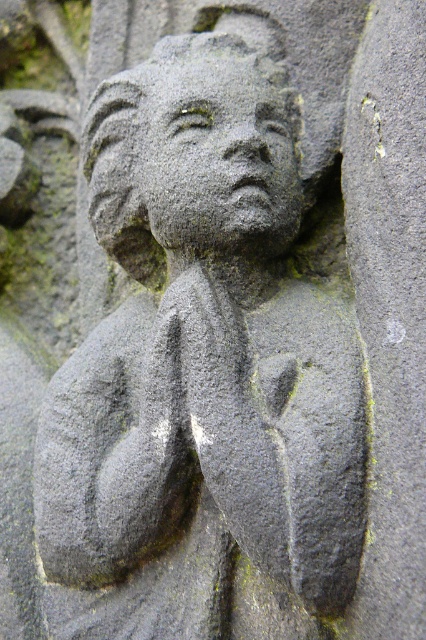
Does gray stone head at center have a lesser height compared to gray stone face at center?

No.

How far apart are gray stone head at center and gray stone face at center?

The distance of gray stone head at center from gray stone face at center is 0.78 centimeters.

Does point (206, 221) come farther from viewer compared to point (210, 67)?

That is False.

This screenshot has height=640, width=426. I want to click on gray stone head at center, so click(x=192, y=154).